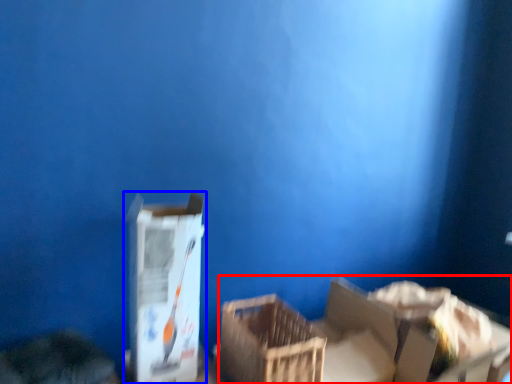
Question: Which object appears farthest to the camera in this image, storage box (highlighted by a red box) or box (highlighted by a blue box)?

Choices:
 (A) storage box
 (B) box

Answer: (A)